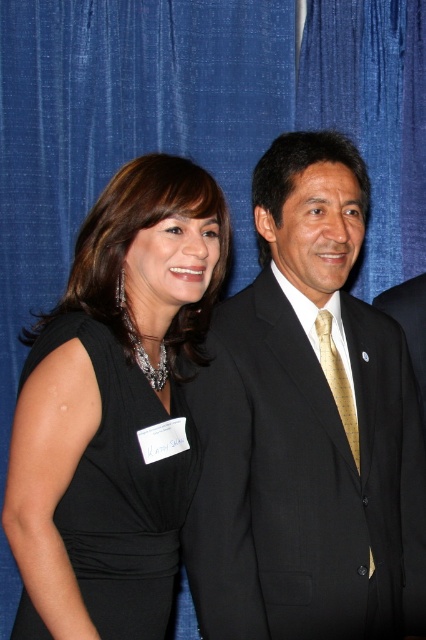
Question: Which object is farther from the camera taking this photo?

Choices:
 (A) black suit at right
 (B) black matte dress at left
 (C) gold woven tie at center

Answer: (C)

Question: Does black suit at right appear on the left side of gold silk tie at center?

Choices:
 (A) yes
 (B) no

Answer: (A)

Question: Which point is farther to the camera?

Choices:
 (A) gold woven tie at center
 (B) black suit at right

Answer: (A)

Question: Can you confirm if black matte dress at left is smaller than gold silk tie at center?

Choices:
 (A) yes
 (B) no

Answer: (B)

Question: Is black suit at right to the right of black matte dress at left from the viewer's perspective?

Choices:
 (A) yes
 (B) no

Answer: (A)

Question: Among these objects, which one is farthest from the camera?

Choices:
 (A) gold woven tie at center
 (B) black matte dress at left

Answer: (A)